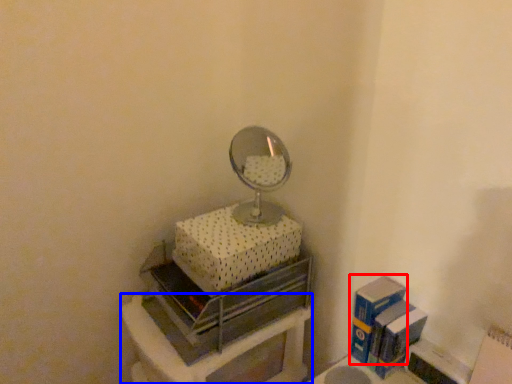
Question: Which point is closer to the camera, box (highlighted by a red box) or furniture (highlighted by a blue box)?

Choices:
 (A) box
 (B) furniture

Answer: (B)